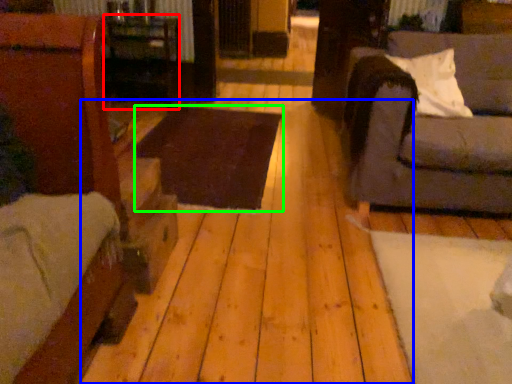
Question: Based on their relative distances, which object is nearer to table (highlighted by a red box)? Choose from plywood (highlighted by a blue box) and table (highlighted by a green box).

Choices:
 (A) plywood
 (B) table

Answer: (B)